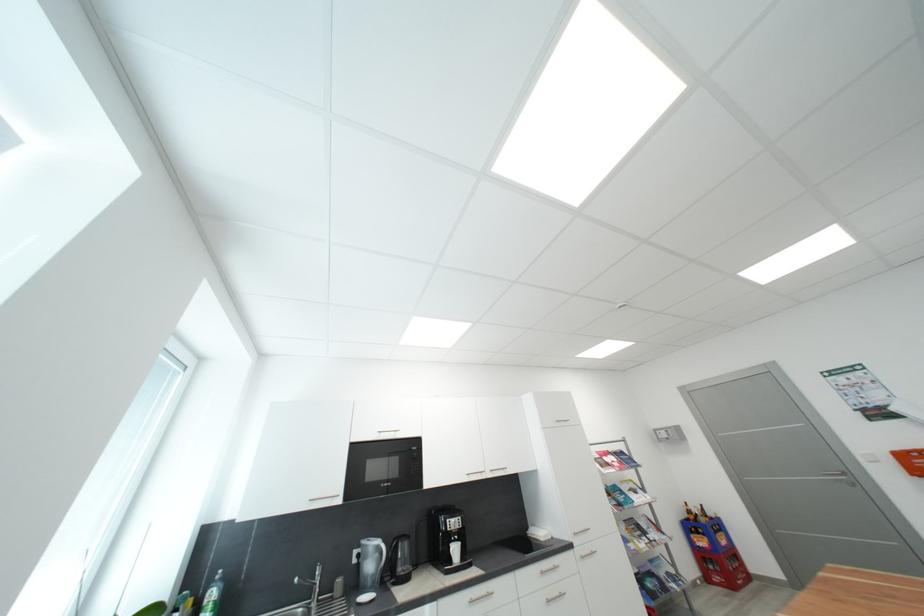
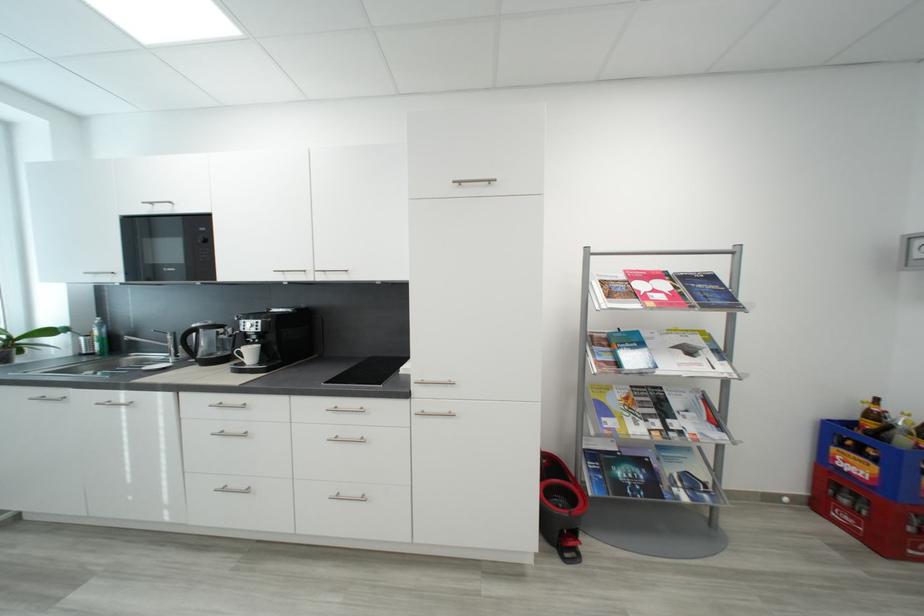
Find the pixel in the second image that matches (x=659, y=576) in the first image.

(650, 464)